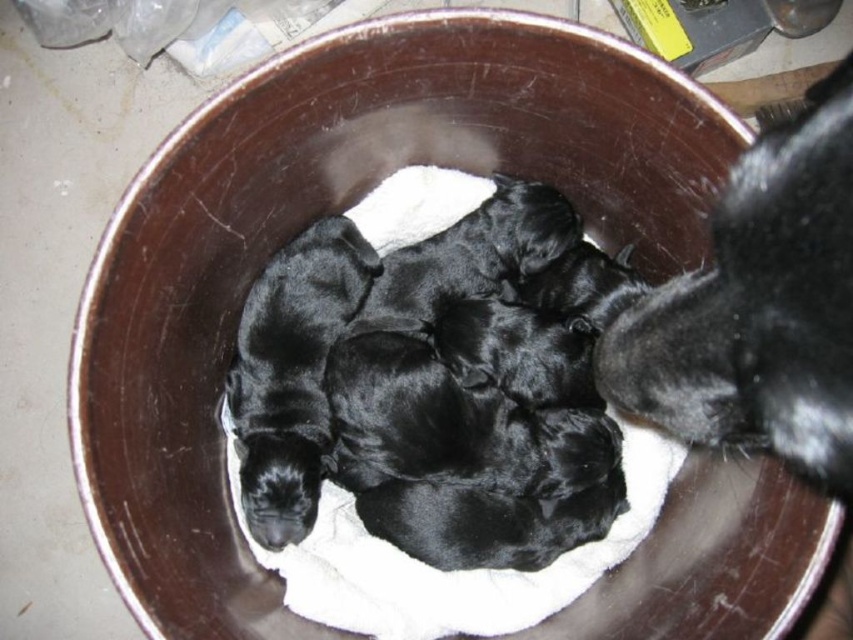
Which is below, black smooth puppies at center or black fur at right?

black smooth puppies at center

This screenshot has height=640, width=853. What do you see at coordinates (474, 436) in the screenshot?
I see `black smooth puppies at center` at bounding box center [474, 436].

What do you see at coordinates (474, 436) in the screenshot? I see `black smooth puppies at center` at bounding box center [474, 436].

Where is `black smooth puppies at center`? The height and width of the screenshot is (640, 853). black smooth puppies at center is located at coordinates (474, 436).